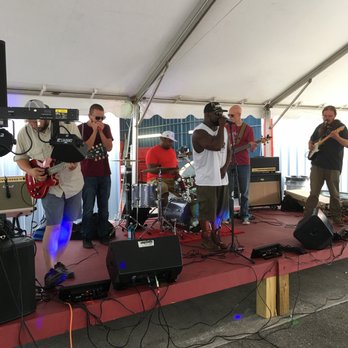
I want to click on stage, so click(x=205, y=268).